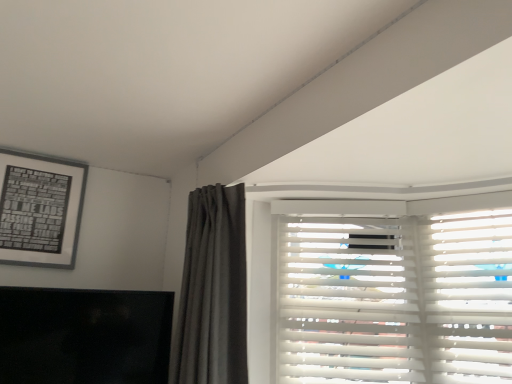
Question: From a real-world perspective, is black matte tv at lower left above or below black matte picture frame at upper left?

Choices:
 (A) below
 (B) above

Answer: (A)

Question: Would you say black matte tv at lower left is to the left or to the right of black matte picture frame at upper left in the picture?

Choices:
 (A) left
 (B) right

Answer: (B)

Question: Considering the real-world distances, which object is farthest from the white wood blinds at upper right?

Choices:
 (A) black matte tv at lower left
 (B) black matte picture frame at upper left

Answer: (B)

Question: Considering the real-world distances, which object is farthest from the black matte tv at lower left?

Choices:
 (A) white wood blinds at upper right
 (B) black matte picture frame at upper left

Answer: (A)